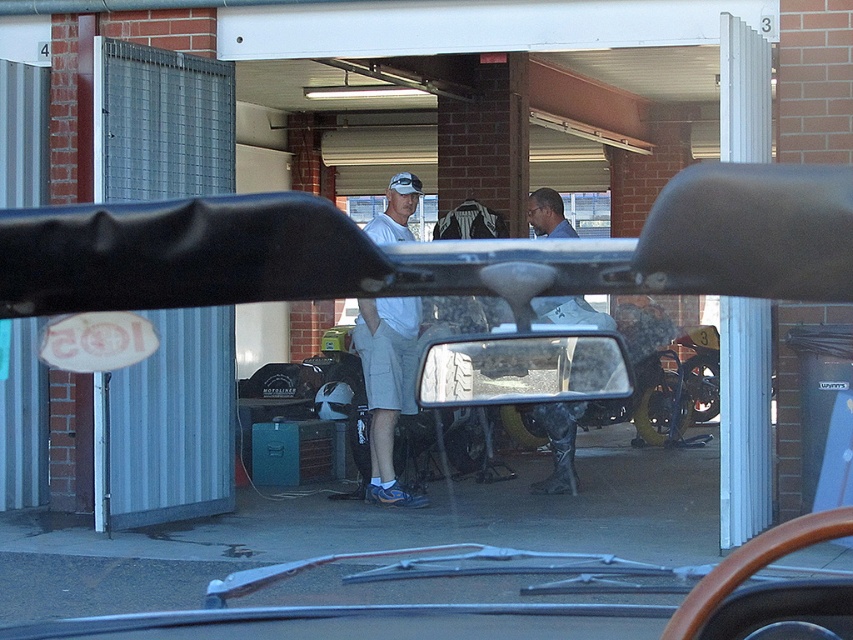
Question: From the image, what is the correct spatial relationship of matte black motorcycle at center in relation to dark gray rubber boots at center?

Choices:
 (A) right
 (B) left

Answer: (B)

Question: Is matte black motorcycle at center above white matte baseball cap at center?

Choices:
 (A) yes
 (B) no

Answer: (B)

Question: Among these objects, which one is nearest to the camera?

Choices:
 (A) metallic reflective mirror at center
 (B) dark gray rubber boots at center

Answer: (A)

Question: Which of the following is the closest to the observer?

Choices:
 (A) matte black motorcycle at center
 (B) metallic reflective mirror at center

Answer: (A)

Question: Where is matte black motorcycle at center located in relation to white matte shorts at center in the image?

Choices:
 (A) above
 (B) below

Answer: (A)

Question: Which point is closer to the camera?

Choices:
 (A) white matte baseball cap at center
 (B) dark gray rubber boots at center
 (C) white matte shorts at center

Answer: (C)